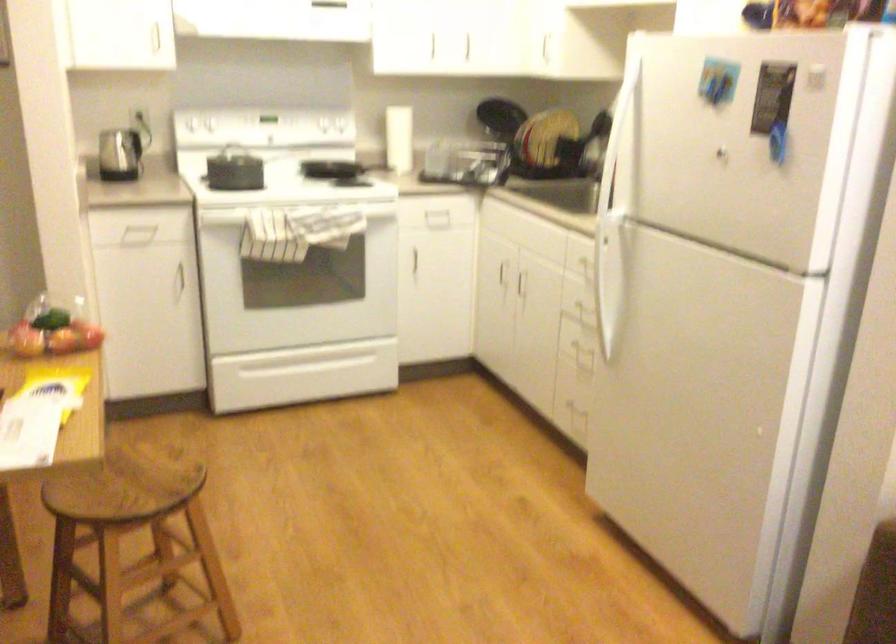
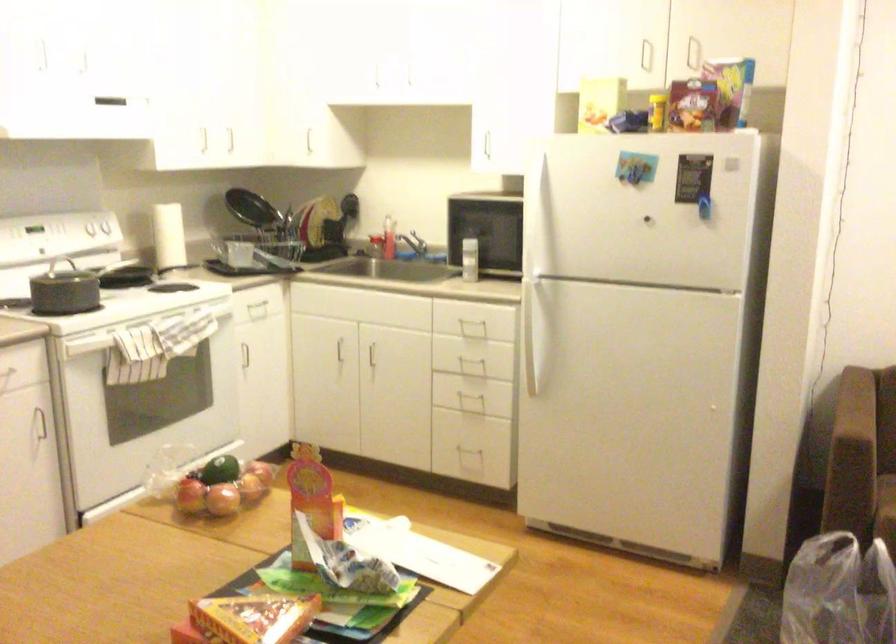
Where in the second image is the point corresponding to point (298, 261) from the first image?

(174, 382)